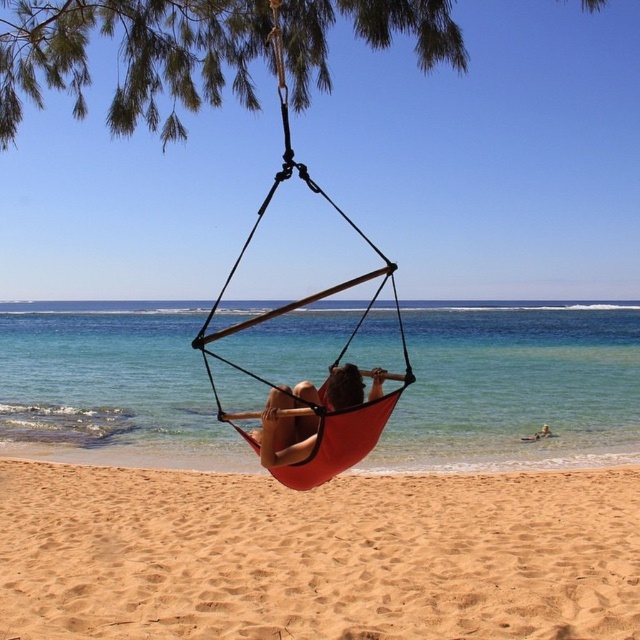
Question: Is clear blue water at center to the left of orange fabric hammock at center from the viewer's perspective?

Choices:
 (A) yes
 (B) no

Answer: (B)

Question: Is orange fabric hammock at center wider than matte orange hammock at center?

Choices:
 (A) no
 (B) yes

Answer: (B)

Question: Which object is positioned closest to the clear blue water at center?

Choices:
 (A) green leafy tree at upper center
 (B) orange fabric hammock at center

Answer: (B)

Question: Where is sandy yellow at lower center located in relation to green leafy tree at upper center in the image?

Choices:
 (A) left
 (B) right

Answer: (B)

Question: Which of the following is the closest to the observer?

Choices:
 (A) clear blue water at center
 (B) sandy yellow at lower center
 (C) green leafy tree at upper center
 (D) matte orange hammock at center

Answer: (D)

Question: Which point appears farthest from the camera in this image?

Choices:
 (A) (330, 474)
 (B) (253, 20)

Answer: (B)